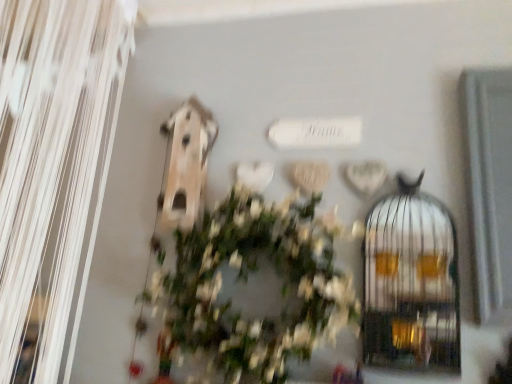
What is the approximate width of green matte wreath at center?

18.04 centimeters.

The width and height of the screenshot is (512, 384). What do you see at coordinates (245, 281) in the screenshot?
I see `green matte wreath at center` at bounding box center [245, 281].

Locate an element on the screen. green matte wreath at center is located at coordinates (245, 281).

What are the coordinates of `green matte wreath at center` in the screenshot? It's located at (245, 281).